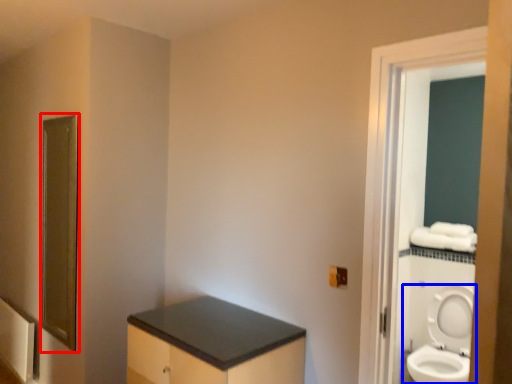
Question: Which object is closer to the camera taking this photo, mirror (highlighted by a red box) or toilet (highlighted by a blue box)?

Choices:
 (A) mirror
 (B) toilet

Answer: (A)